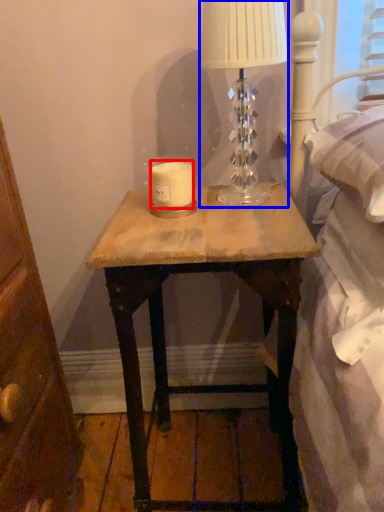
Question: Which of the following is the farthest to the observer, candle (highlighted by a red box) or table lamp (highlighted by a blue box)?

Choices:
 (A) candle
 (B) table lamp

Answer: (A)